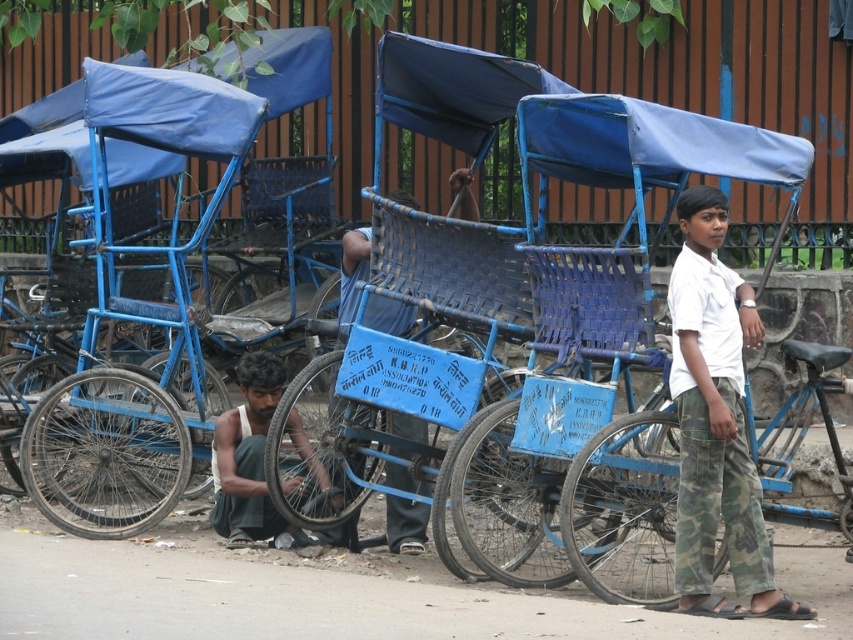
Consider the image. Is white cotton shirt at center to the right of dark blue fabric bicycle at lower left from the viewer's perspective?

Yes, white cotton shirt at center is to the right of dark blue fabric bicycle at lower left.

Who is higher up, white cotton shirt at center or dark blue fabric bicycle at lower left?

white cotton shirt at center is above.

Does point (693, 259) lie behind point (289, 412)?

No.

Find the location of a particular element. white cotton shirt at center is located at coordinates (715, 422).